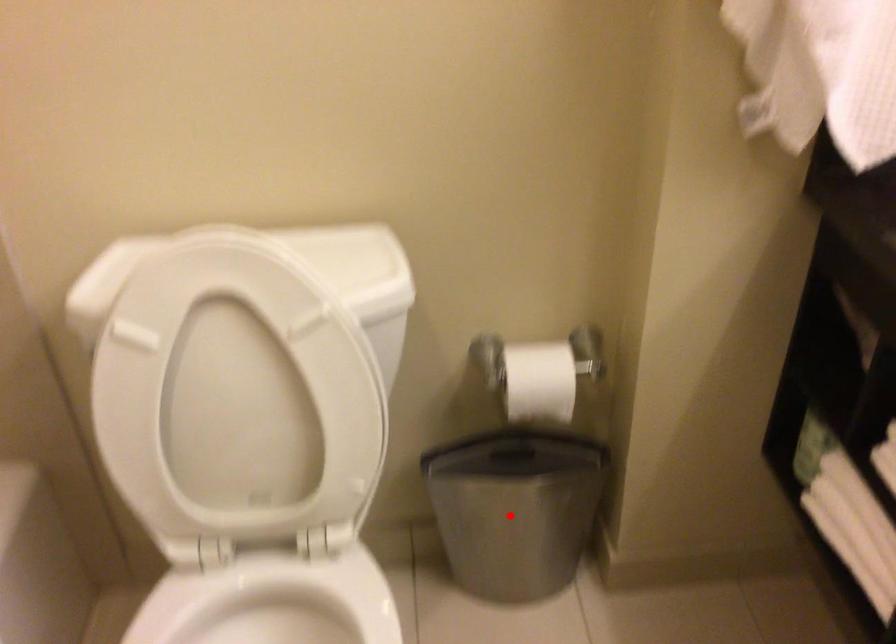
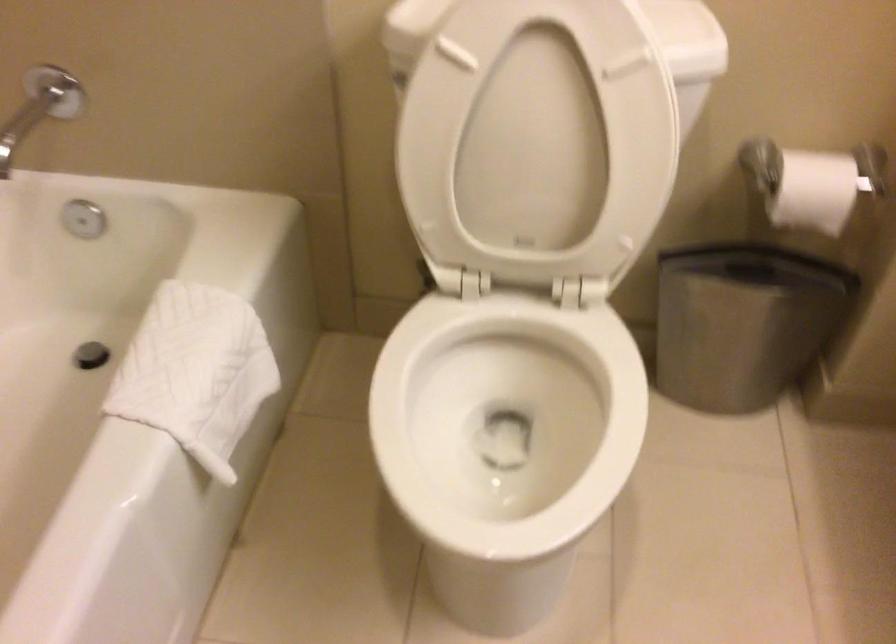
Locate, in the second image, the point that corresponds to the highlighted location in the first image.

(743, 323)